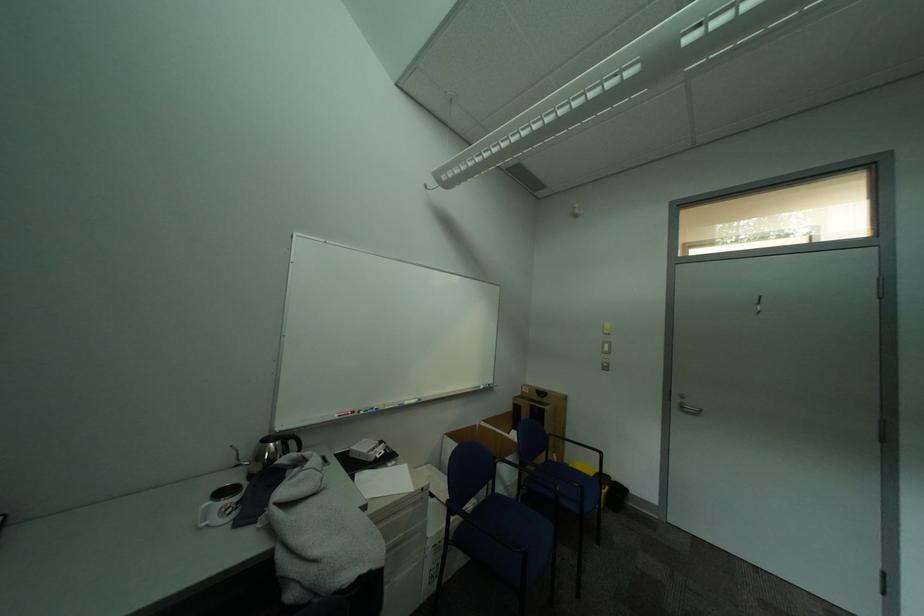
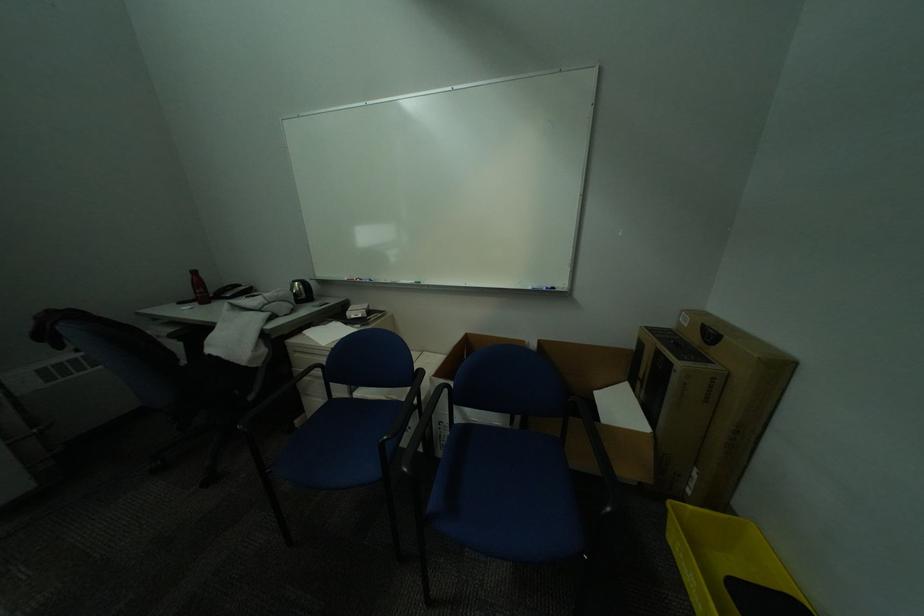
Find the pixel in the second image that matches the point at 533,391 in the first image.

(691, 321)